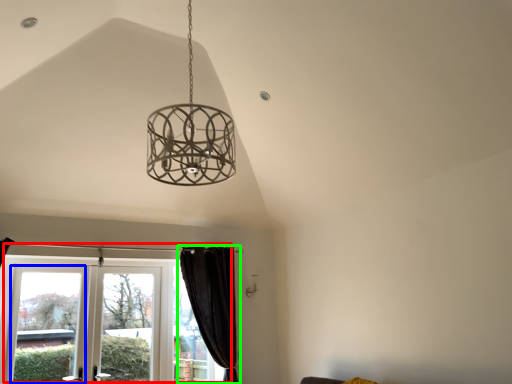
Question: Based on their relative distances, which object is nearer to window (highlighted by a red box)? Choose from window (highlighted by a blue box) and curtain (highlighted by a green box).

Choices:
 (A) window
 (B) curtain

Answer: (A)